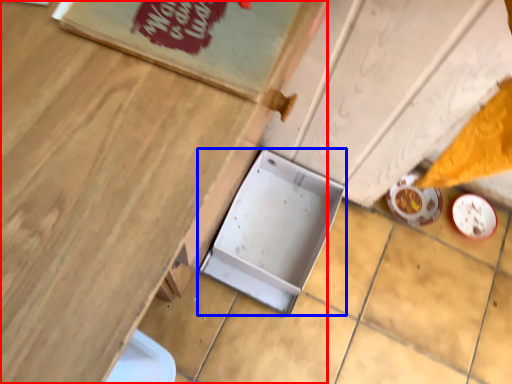
Question: Which of the following is the farthest to the observer, table (highlighted by a red box) or box (highlighted by a blue box)?

Choices:
 (A) table
 (B) box

Answer: (B)